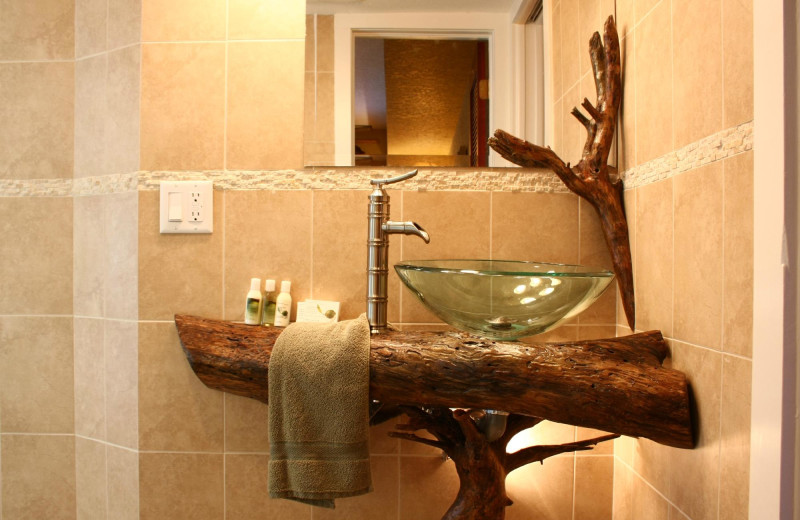
Identify the location of faucet. (418, 227).